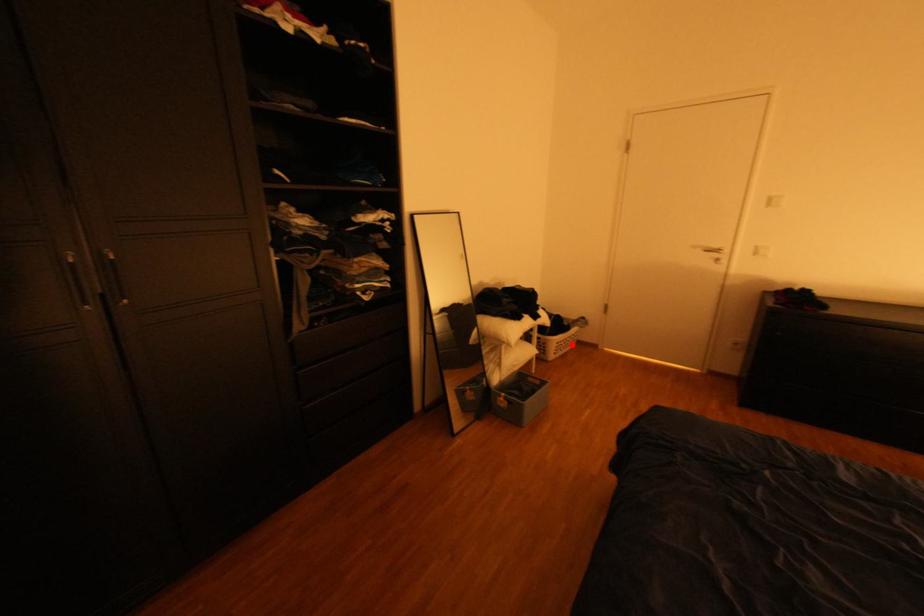
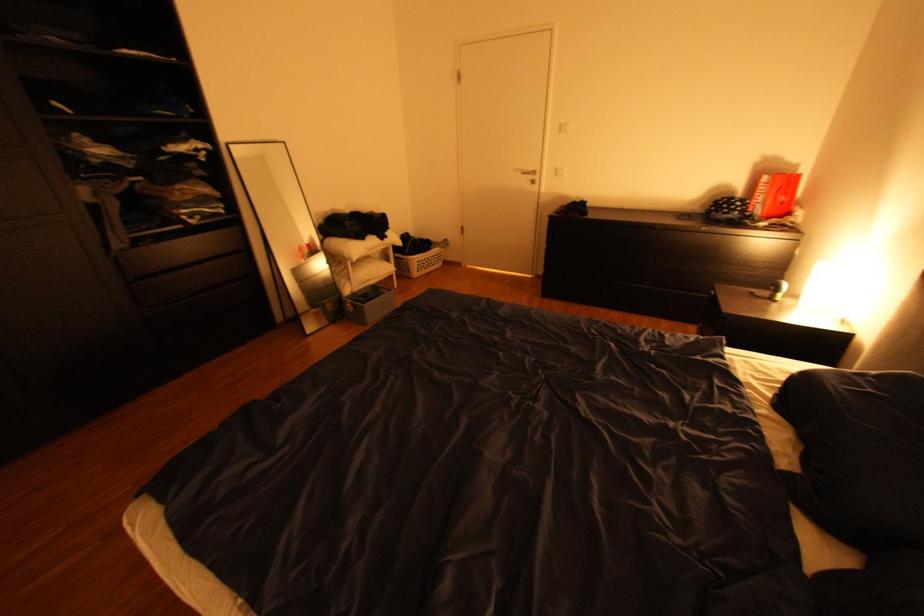
The point at the highlighted location is marked in the first image. Where is the corresponding point in the second image?

(433, 264)